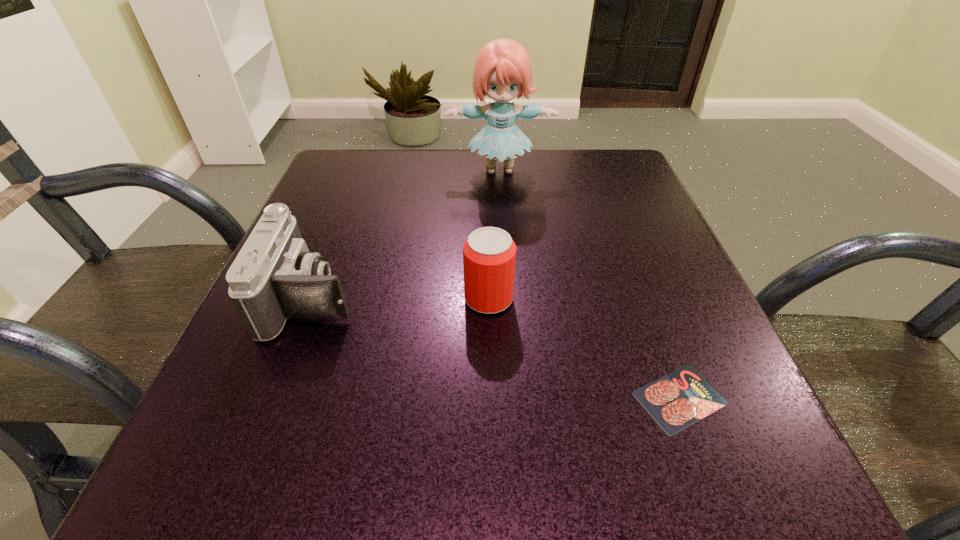
Identify the location of vacant space at the far right corner of the desktop. The width and height of the screenshot is (960, 540). [x=595, y=193].

Identify the location of free space that is in between the camera and the beer can. Image resolution: width=960 pixels, height=540 pixels. (401, 298).

Identify the location of free spot between the camera and the tallest object. (406, 234).

I want to click on vacant area that lies between the doll and the leftmost object, so click(x=406, y=234).

Where is `free space between the tallest object and the nearest object`? The image size is (960, 540). free space between the tallest object and the nearest object is located at coordinates (589, 284).

Where is `blank region between the salami and the beer can`? Image resolution: width=960 pixels, height=540 pixels. blank region between the salami and the beer can is located at coordinates (585, 348).

Locate an element on the screen. The image size is (960, 540). vacant point located between the rightmost object and the beer can is located at coordinates (585, 348).

Where is `free area in between the salami and the farthest object`? Image resolution: width=960 pixels, height=540 pixels. free area in between the salami and the farthest object is located at coordinates (589, 284).

In order to click on vacant space in between the tallest object and the salami in this screenshot , I will do [x=589, y=284].

Where is `free space that is in between the leftmost object and the rightmost object`? The width and height of the screenshot is (960, 540). free space that is in between the leftmost object and the rightmost object is located at coordinates (496, 348).